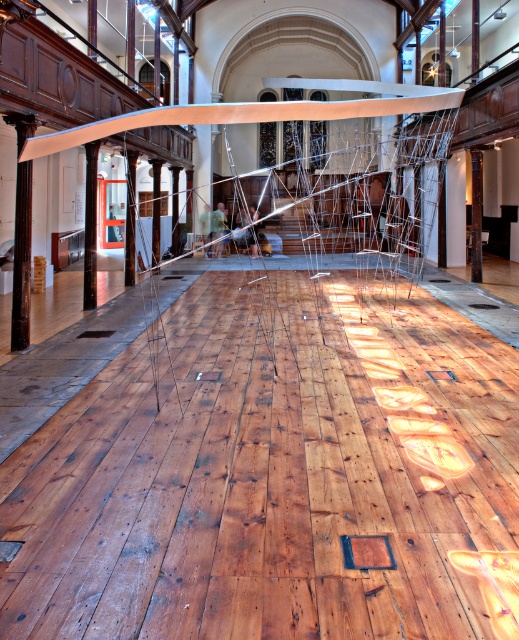
Question: Which of the following is the closest to the observer?

Choices:
 (A) metallic wire at center
 (B) white metallic beam at upper center

Answer: (B)

Question: Which object appears closest to the camera in this image?

Choices:
 (A) metallic wire at center
 (B) white metallic beam at upper center

Answer: (B)

Question: Is metallic wire at center positioned behind white metallic beam at upper center?

Choices:
 (A) no
 (B) yes

Answer: (B)

Question: Can you confirm if metallic wire at center is positioned to the left of white metallic beam at upper center?

Choices:
 (A) yes
 (B) no

Answer: (B)

Question: Does metallic wire at center have a larger size compared to white metallic beam at upper center?

Choices:
 (A) no
 (B) yes

Answer: (A)

Question: Which object appears closest to the camera in this image?

Choices:
 (A) white metallic beam at upper center
 (B) metallic wire at center

Answer: (A)